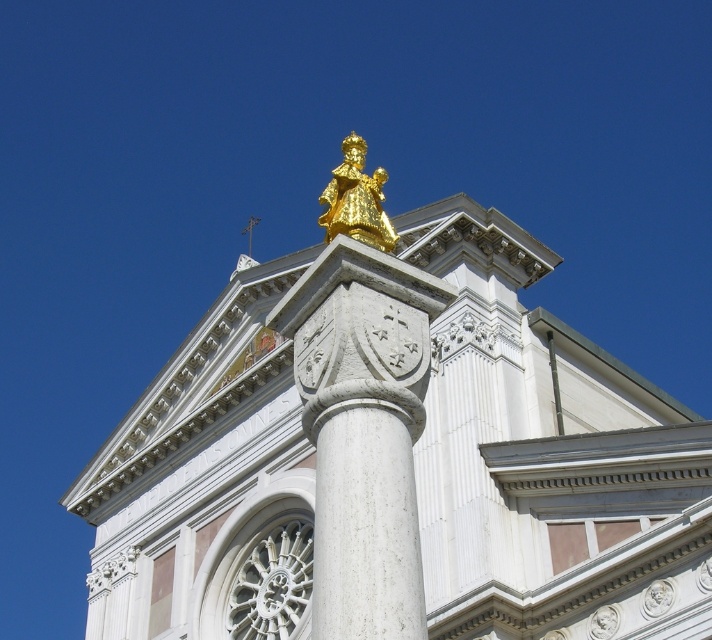
At what (x,y) coordinates should I click in order to perform the action: click on gold statue at center. Please return your answer as a coordinate pair (x, y). This screenshot has width=712, height=640. Looking at the image, I should click on (397, 460).

Can you confirm if gold statue at center is bigger than gold polished statue at upper center?

Actually, gold statue at center might be smaller than gold polished statue at upper center.

Measure the distance between point (x=585, y=547) and camera.

127.99 feet

Image resolution: width=712 pixels, height=640 pixels. I want to click on gold statue at center, so click(397, 460).

Between point (417, 554) and point (389, 225), which one is positioned in front?

Point (417, 554)

Who is positioned more to the right, white marble column at center or gold polished statue at upper center?

white marble column at center

Which is behind, point (375, 476) or point (372, 225)?

Positioned behind is point (372, 225).

Find the location of a particular element. The image size is (712, 640). white marble column at center is located at coordinates (365, 512).

Does point (324, 563) lie in front of point (408, 461)?

Yes, point (324, 563) is in front of point (408, 461).

Which is more to the right, white marble column at upper center or white marble column at center?

white marble column at center is more to the right.

Does point (439, 310) lie in front of point (340, 524)?

No.

Find the location of a particular element. The height and width of the screenshot is (640, 712). white marble column at upper center is located at coordinates point(362,432).